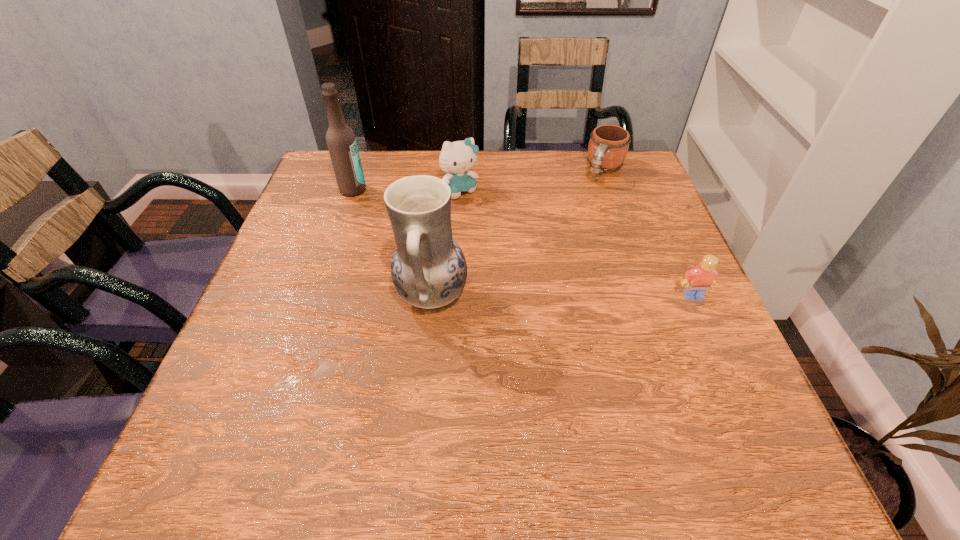
The width and height of the screenshot is (960, 540). Find the location of `vacant space that satisfies the following two spatial constraints: 1. on the back side of the leftmost object; 2. on the left side of the mug`. vacant space that satisfies the following two spatial constraints: 1. on the back side of the leftmost object; 2. on the left side of the mug is located at coordinates point(360,170).